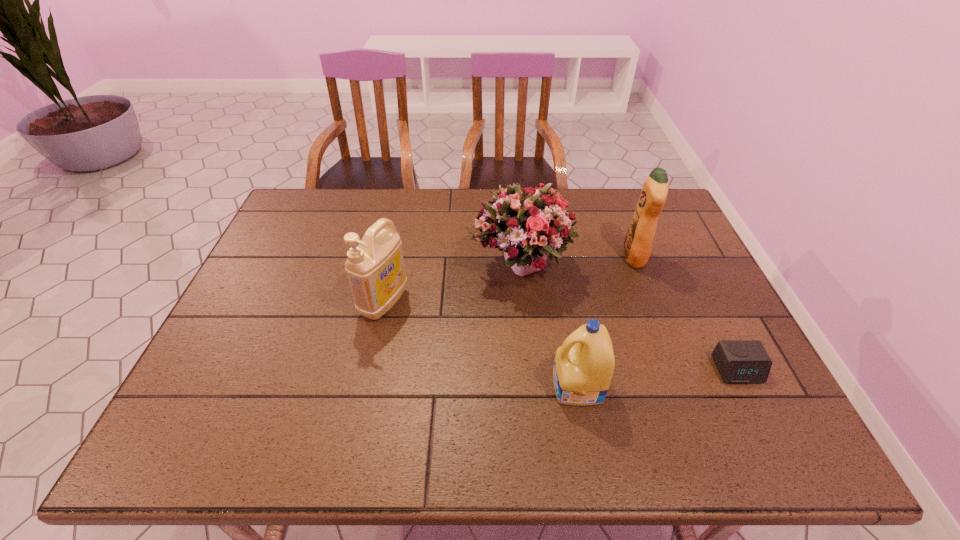
This screenshot has height=540, width=960. Identify the location of free spot that satisfies the following two spatial constraints: 1. on the front-facing side of the shortest object; 2. on the label of the shortest detergent. (745, 386).